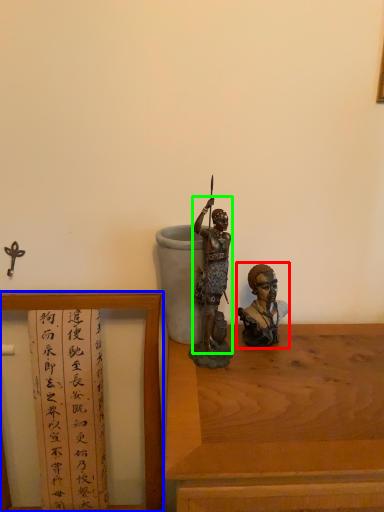
Question: Which object is the farthest from person (highlighted by a red box)? Choose among these: furniture (highlighted by a blue box) or person (highlighted by a green box).

Choices:
 (A) furniture
 (B) person

Answer: (A)